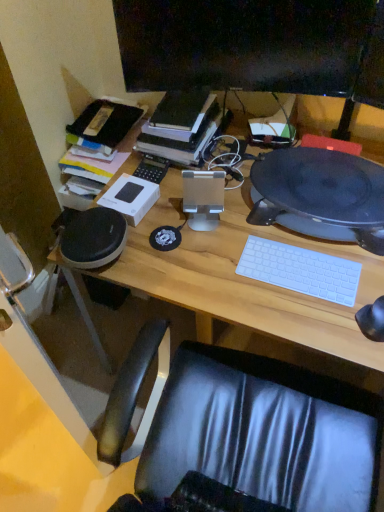
Locate an element on the screen. Image resolution: width=384 pixels, height=512 pixels. free location to the left of black matte speaker at right is located at coordinates (203, 233).